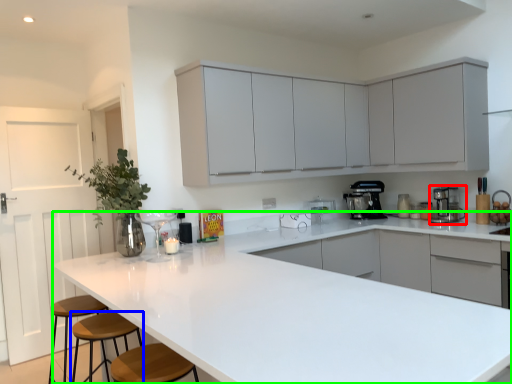
Question: Estimate the real-world distances between objects in this image. Which object is farther from home appliance (highlighted by a red box), bar stool (highlighted by a blue box) or countertop (highlighted by a green box)?

Choices:
 (A) bar stool
 (B) countertop

Answer: (A)